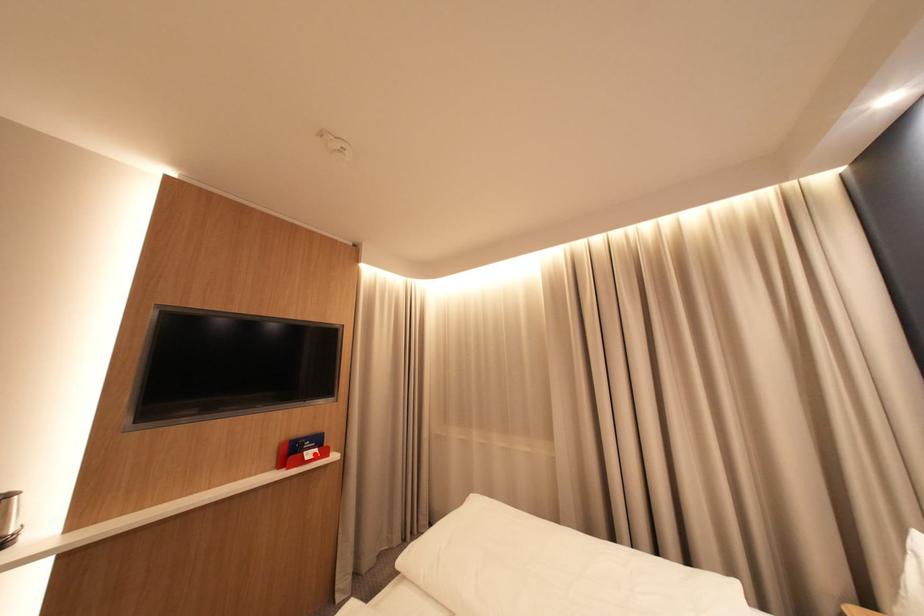
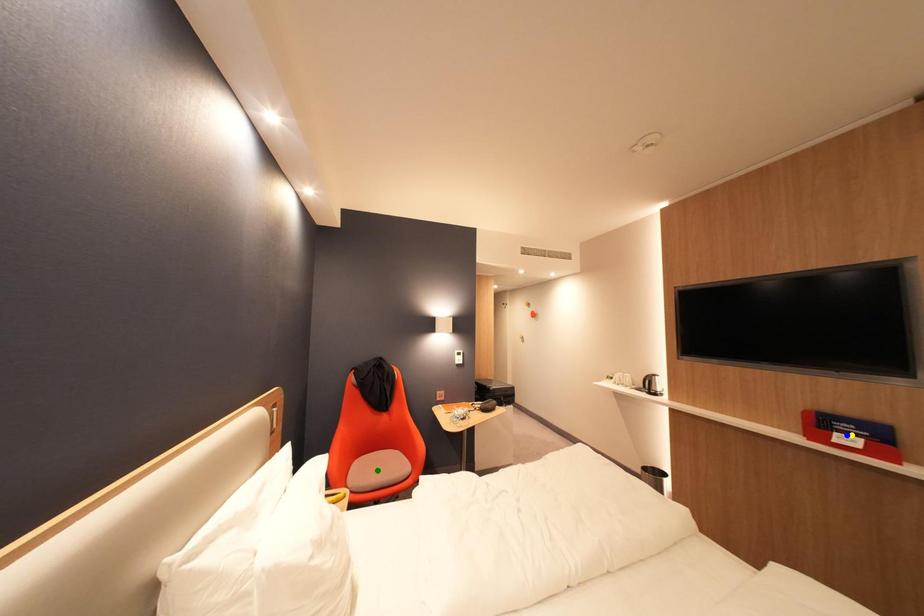
Question: I am providing you with two images of the same scene from different viewpoints. A red point is marked on the first image. You are given multiple points on the second image. Which point in image 2 represents the same 3d spot as the red point in image 1?

Choices:
 (A) green point
 (B) yellow point
 (C) blue point

Answer: (C)